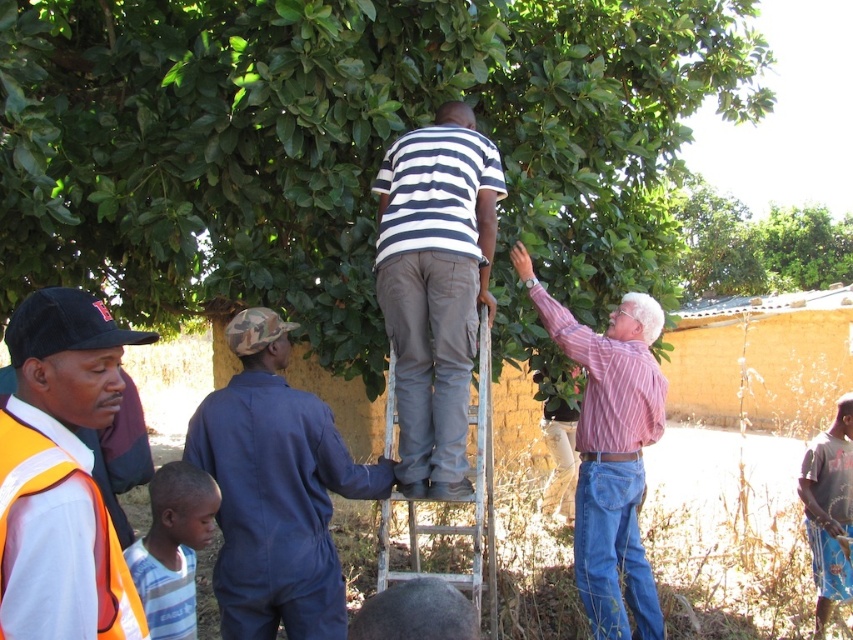
You are a person who wants to pick a fruit from the top of the metallic silver ladder at center. The pink striped shirt at upper right is blocking your view. Can you still reach the fruit without moving them?

The pink striped shirt at upper right is much taller than the metallic silver ladder at center, so the ladder might not be tall enough to reach the fruit if the person in the pink striped shirt is already taller. Therefore, you might need to move the pink striped shirt at upper right to have a clearer path or use a taller ladder.

You are standing in the outdoor scene and want to pick fruit from the green leafy tree at upper center. The blue coveralls at center is blocking your path. Can you walk around them to reach the base of the tree?

The green leafy tree at upper center is taller than the blue coveralls at center, so yes, you can walk around the blue coveralls at center to reach the base of the tree since it is shorter than the tree.